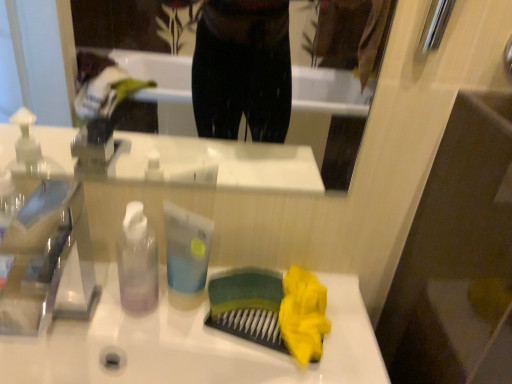
Question: In terms of size, does translucent plastic bottle at center appear bigger or smaller than transparent plastic bottle at center?

Choices:
 (A) big
 (B) small

Answer: (B)

Question: Is translucent plastic bottle at center to the left or to the right of transparent plastic bottle at center in the image?

Choices:
 (A) left
 (B) right

Answer: (B)

Question: Which is nearer to the transparent plastic bottle at center?

Choices:
 (A) transparent plastic faucet at left
 (B) translucent plastic bottle at center

Answer: (B)

Question: Which object is positioned farthest from the translucent plastic bottle at center?

Choices:
 (A) transparent plastic bottle at center
 (B) transparent plastic faucet at left

Answer: (B)